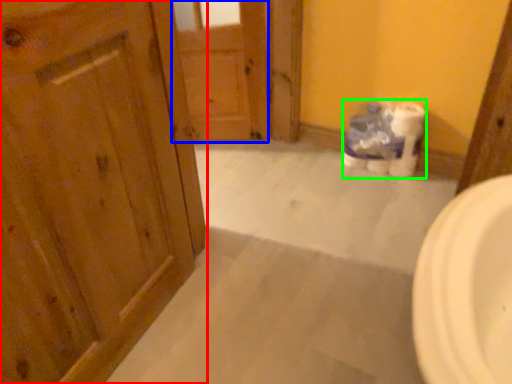
Question: Based on their relative distances, which object is farther from door (highlighted by a red box)? Choose from door (highlighted by a blue box) and toilet paper (highlighted by a green box).

Choices:
 (A) door
 (B) toilet paper

Answer: (B)